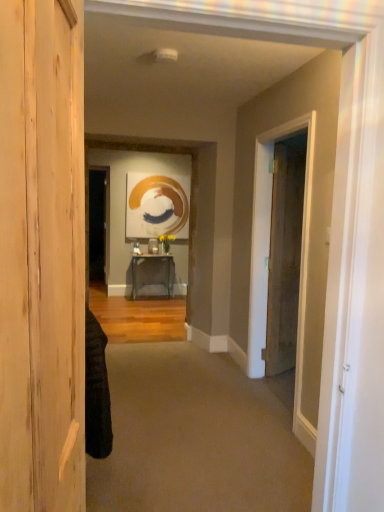
The width and height of the screenshot is (384, 512). In order to click on vacant space situated above carpet at center (from a real-world perspective) in this screenshot , I will do `click(180, 399)`.